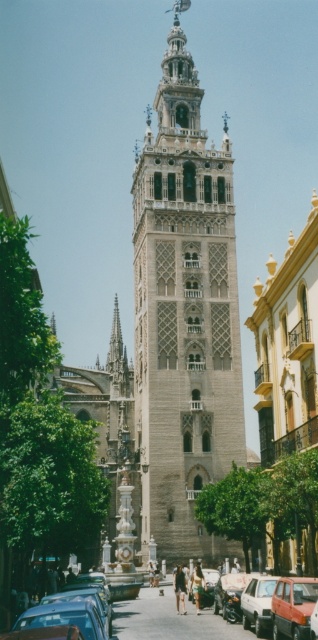
Is matte silver car at center positioned in front of matte red car at center?

No, matte silver car at center is behind matte red car at center.

Is matte silver car at center wider than matte red car at center?

Indeed, matte silver car at center has a greater width compared to matte red car at center.

Does point (249, 604) lie behind point (316, 627)?

Yes, it is behind point (316, 627).

I want to click on matte silver car at center, so click(x=257, y=604).

Is stone tower at center to the left of matte red car at center from the viewer's perspective?

Indeed, stone tower at center is positioned on the left side of matte red car at center.

In order to click on stone tower at center in this screenshot , I will do `click(184, 314)`.

Identify the location of stone tower at center. (184, 314).

Does stone tower at center have a smaller size compared to matte silver car at center?

Actually, stone tower at center might be larger than matte silver car at center.

Who is lower down, stone tower at center or matte silver car at center?

Positioned lower is matte silver car at center.

Does point (185, 301) come in front of point (261, 612)?

No, (185, 301) is further to viewer.

Image resolution: width=318 pixels, height=640 pixels. I want to click on stone tower at center, so click(x=184, y=314).